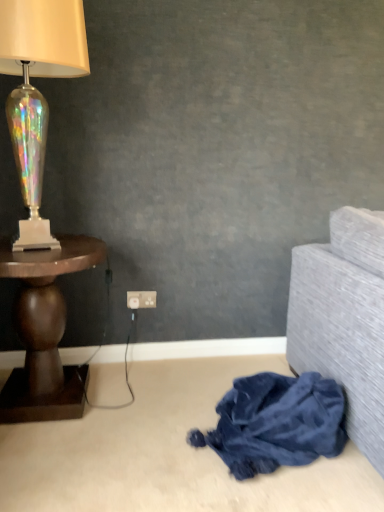
Locate an element on the screen. velvety blue blanket at lower right is located at coordinates (276, 423).

This screenshot has width=384, height=512. Identify the location of white plastic power outlet at center. (141, 298).

The width and height of the screenshot is (384, 512). What are the coordinates of `velvety blue blanket at lower right` in the screenshot? It's located at (276, 423).

Considering the positions of objects velvety blue blanket at lower right and white plastic power outlet at center in the image provided, who is behind, velvety blue blanket at lower right or white plastic power outlet at center?

Positioned behind is white plastic power outlet at center.

From a real-world perspective, between velvety blue blanket at lower right and white plastic power outlet at center, who is vertically lower?

velvety blue blanket at lower right.

The width and height of the screenshot is (384, 512). I want to click on power outlet that appears above the velvety blue blanket at lower right (from a real-world perspective), so click(141, 298).

Which object is positioned more to the right, velvety blue blanket at lower right or white plastic power outlet at center?

velvety blue blanket at lower right is more to the right.

Does iridescent glass lamp at left have a smaller size compared to white plastic power outlet at center?

No, iridescent glass lamp at left is not smaller than white plastic power outlet at center.

Would you say iridescent glass lamp at left is a long distance from white plastic power outlet at center?

That's not correct — iridescent glass lamp at left is a little close to white plastic power outlet at center.

From the image's perspective, relative to white plastic power outlet at center, is iridescent glass lamp at left above or below?

iridescent glass lamp at left is above white plastic power outlet at center.

Is white plastic power outlet at center touching dark wood table at left?

No, white plastic power outlet at center is not beside dark wood table at left.

Is white plastic power outlet at center wider than dark wood table at left?

No.

Could you tell me if white plastic power outlet at center is turned towards dark wood table at left?

No.

Between white plastic power outlet at center and dark wood table at left, which one has less height?

white plastic power outlet at center.

Is dark wood table at left not close to velvety blue blanket at lower right?

No, there isn't a large distance between dark wood table at left and velvety blue blanket at lower right.

In terms of height, does dark wood table at left look taller or shorter compared to velvety blue blanket at lower right?

Considering their sizes, dark wood table at left has more height than velvety blue blanket at lower right.

Which point is more forward, (x=44, y=268) or (x=282, y=434)?

The point (x=282, y=434) is more forward.

From the image's perspective, which object appears higher, dark wood table at left or velvety blue blanket at lower right?

dark wood table at left, from the image's perspective.

Does velvety blue blanket at lower right have a lesser height compared to dark wood table at left?

Yes, velvety blue blanket at lower right is shorter than dark wood table at left.

Choose the correct answer: Is velvety blue blanket at lower right inside dark wood table at left or outside it?

velvety blue blanket at lower right exists outside the volume of dark wood table at left.

Does velvety blue blanket at lower right have a larger size compared to dark wood table at left?

No, velvety blue blanket at lower right is not bigger than dark wood table at left.

From the image's perspective, relative to dark wood table at left, is velvety blue blanket at lower right above or below?

velvety blue blanket at lower right is below dark wood table at left.

From a real-world perspective, is white plastic power outlet at center located higher than velvety blue blanket at lower right?

Yes, from a real-world perspective, white plastic power outlet at center is over velvety blue blanket at lower right

Would you say white plastic power outlet at center is a long distance from velvety blue blanket at lower right?

white plastic power outlet at center is actually quite close to velvety blue blanket at lower right.

Where is `power outlet on the left of velvety blue blanket at lower right`? Image resolution: width=384 pixels, height=512 pixels. power outlet on the left of velvety blue blanket at lower right is located at coordinates (141, 298).

Is point (146, 296) less distant than point (233, 420)?

No, it is behind (233, 420).

Measure the distance between dark wood table at left and white plastic power outlet at center.

They are 20.99 inches apart.

From the image's perspective, does dark wood table at left appear lower than white plastic power outlet at center?

Yes, from the image's perspective, dark wood table at left is beneath white plastic power outlet at center.

Are dark wood table at left and white plastic power outlet at center making contact?

dark wood table at left is not next to white plastic power outlet at center, and they're not touching.

Is dark wood table at left oriented towards white plastic power outlet at center?

No.

Locate an element on the screen. The height and width of the screenshot is (512, 384). power outlet located above the velvety blue blanket at lower right (from a real-world perspective) is located at coordinates (141, 298).

You are a GUI agent. You are given a task and a screenshot of the screen. Output one action in this format:
    pyautogui.click(x=<x>, y=<y>)
    Task: Click on the lamp in front of the white plastic power outlet at center
    The image size is (384, 512).
    Given the screenshot: What is the action you would take?
    pyautogui.click(x=37, y=91)

Considering their positions, is white plastic power outlet at center positioned closer to iridescent glass lamp at left than velvety blue blanket at lower right?

Among the two, white plastic power outlet at center is located nearer to iridescent glass lamp at left.

Considering their positions, is iridescent glass lamp at left positioned further to white plastic power outlet at center than velvety blue blanket at lower right?

iridescent glass lamp at left.

Based on their spatial positions, is dark wood table at left or white plastic power outlet at center closer to iridescent glass lamp at left?

dark wood table at left is positioned closer to the anchor iridescent glass lamp at left.

From the image, which object appears to be nearer to white plastic power outlet at center, iridescent glass lamp at left or dark wood table at left?

dark wood table at left is positioned closer to the anchor white plastic power outlet at center.

Based on the photo, estimate the real-world distances between objects in this image. Which object is further from dark wood table at left, velvety blue blanket at lower right or iridescent glass lamp at left?

velvety blue blanket at lower right lies further to dark wood table at left than the other object.

From the image, which object appears to be farther from white plastic power outlet at center, dark wood table at left or iridescent glass lamp at left?

iridescent glass lamp at left is further to white plastic power outlet at center.

Based on their spatial positions, is white plastic power outlet at center or velvety blue blanket at lower right further from dark wood table at left?

velvety blue blanket at lower right is positioned further to the anchor dark wood table at left.

Considering their positions, is velvety blue blanket at lower right positioned further to white plastic power outlet at center than iridescent glass lamp at left?

iridescent glass lamp at left.

The image size is (384, 512). What are the coordinates of `table that lies between iridescent glass lamp at left and velvety blue blanket at lower right from top to bottom` in the screenshot? It's located at tap(44, 330).

I want to click on table between iridescent glass lamp at left and white plastic power outlet at center in the front-back direction, so click(44, 330).

In order to click on table located between velvety blue blanket at lower right and white plastic power outlet at center in the depth direction in this screenshot , I will do `click(44, 330)`.

This screenshot has height=512, width=384. Find the location of `power outlet between iridescent glass lamp at left and velvety blue blanket at lower right in the vertical direction`. power outlet between iridescent glass lamp at left and velvety blue blanket at lower right in the vertical direction is located at coordinates (141, 298).